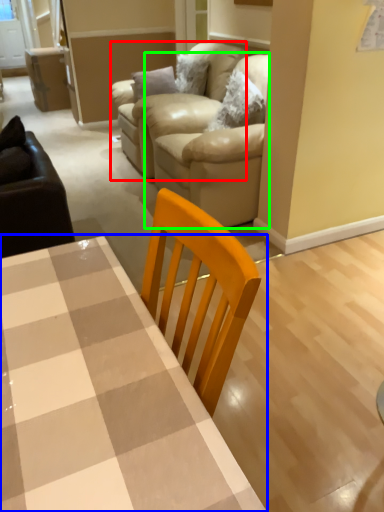
Question: Which object is the farthest from armchair (highlighted by a red box)? Choose among these: table (highlighted by a blue box) or couch (highlighted by a green box).

Choices:
 (A) table
 (B) couch

Answer: (A)